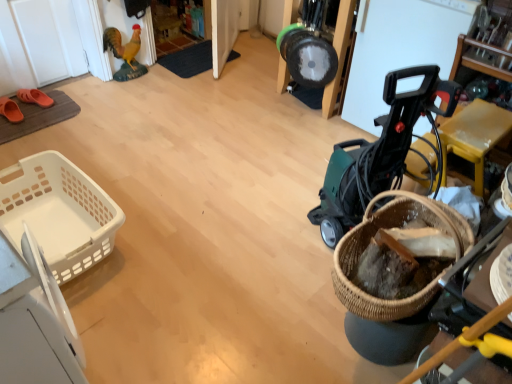
I want to click on free space between orange rubber sandals at left, which appears as the 1th footwear when viewed from the front, and orange rubber clog at left, marked as the 2th footwear in a front-to-back arrangement, so click(30, 114).